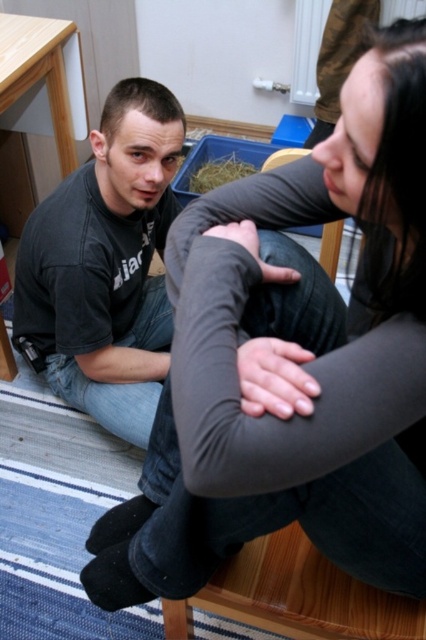
Question: Is black cotton shirt at left to the right of brown straw at center from the viewer's perspective?

Choices:
 (A) yes
 (B) no

Answer: (B)

Question: Which of the following is the closest to the observer?

Choices:
 (A) (166, 125)
 (B) (244, 168)

Answer: (A)

Question: Which point is farther to the camera?

Choices:
 (A) black cotton shirt at left
 (B) brown straw at center

Answer: (B)

Question: Which point is closer to the camera?

Choices:
 (A) black cotton shirt at left
 (B) brown straw at center

Answer: (A)

Question: Does black cotton shirt at left come behind brown straw at center?

Choices:
 (A) yes
 (B) no

Answer: (B)

Question: Is the position of black cotton shirt at left less distant than that of brown straw at center?

Choices:
 (A) no
 (B) yes

Answer: (B)